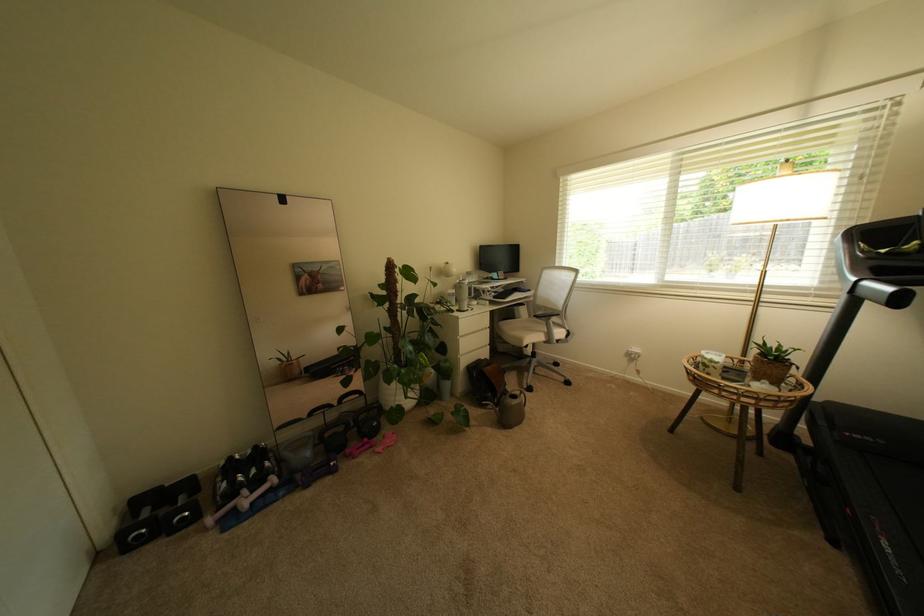
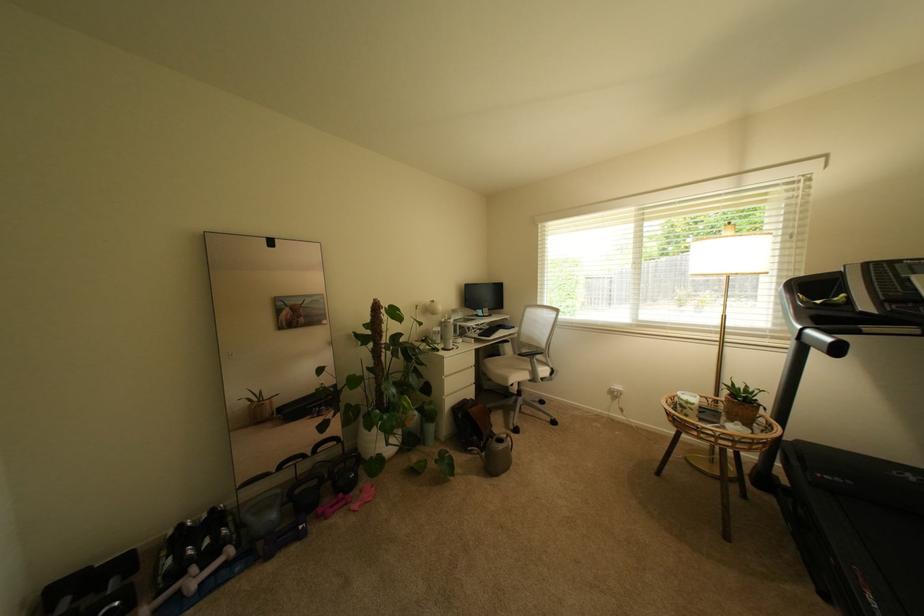
Question: I am providing you with two images of the same scene from different viewpoints. Please identify which objects are invisible in image2.

Choices:
 (A) black dumbbell
 (B) black kettlebell
 (C) white chair sitting surface
 (D) none of these

Answer: (D)